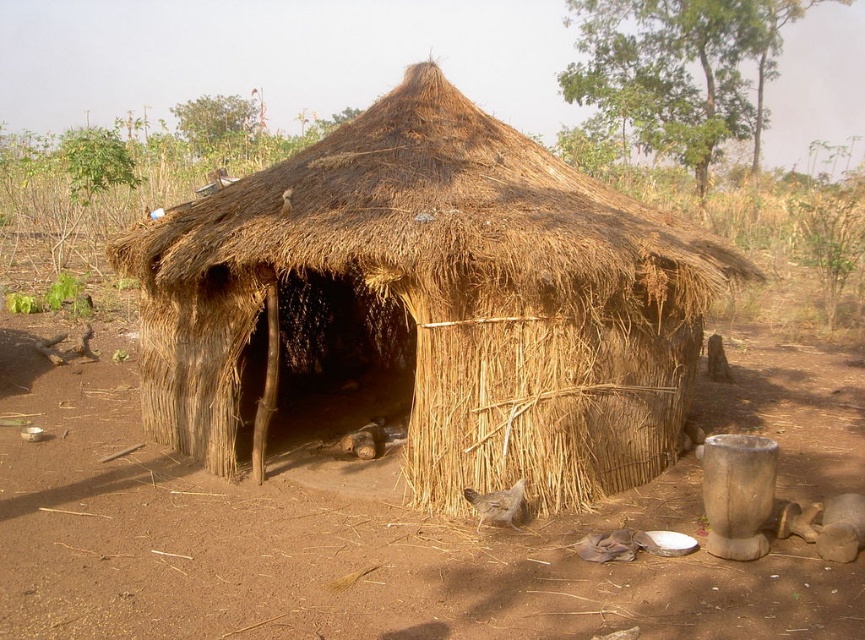
Who is lower down, brown thatch hut at center or gray feathered chicken at lower center?

Positioned lower is gray feathered chicken at lower center.

Does point (569, 464) come behind point (487, 516)?

Yes, it is.

Where is `brown thatch hut at center`? Image resolution: width=865 pixels, height=640 pixels. brown thatch hut at center is located at coordinates (433, 304).

Which of these two, brown dirt field at center or gray feathered chicken at lower center, stands taller?

Standing taller between the two is brown dirt field at center.

Which is in front, point (80, 480) or point (488, 516)?

Point (488, 516)

Find the location of a particular element. brown dirt field at center is located at coordinates (332, 538).

Is brown thatch hut at center closer to camera compared to brown dirt field at center?

No, it is not.

Who is positioned more to the right, brown thatch hut at center or brown dirt field at center?

Positioned to the right is brown thatch hut at center.

Identify the location of brown thatch hut at center. The image size is (865, 640). (433, 304).

This screenshot has width=865, height=640. Find the location of `brown thatch hut at center`. brown thatch hut at center is located at coordinates (433, 304).